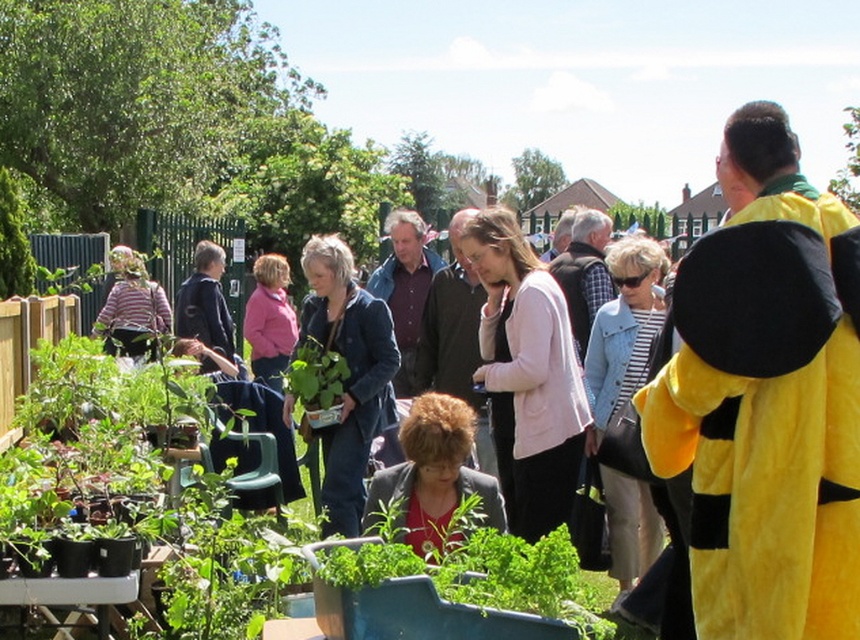
Is yellow plush bee at right thinner than pink fabric at center?

No.

Is point (797, 608) closer to viewer compared to point (575, 426)?

Yes, point (797, 608) is closer to viewer.

Does point (722, 522) come behind point (539, 440)?

No, it is in front of (539, 440).

In order to click on yellow plush bee at right in this screenshot , I will do `click(766, 401)`.

Is pink fabric at center above striped cotton shirt at center?

Actually, pink fabric at center is below striped cotton shirt at center.

Is pink fabric at center positioned behind striped cotton shirt at center?

That is False.

The image size is (860, 640). I want to click on pink fabric at center, so [527, 374].

Who is more forward, (398, 493) or (195, 252)?

Point (398, 493)

Looking at this image, can you confirm if matte black jacket at center is positioned above dark blue jacket at center?

No, matte black jacket at center is not above dark blue jacket at center.

Who is more distant from viewer, (432, 483) or (212, 278)?

The point (212, 278) is behind.

At what (x,y) coordinates should I click in order to perform the action: click on matte black jacket at center. Please return your answer as a coordinate pair (x, y). Looking at the image, I should click on (433, 474).